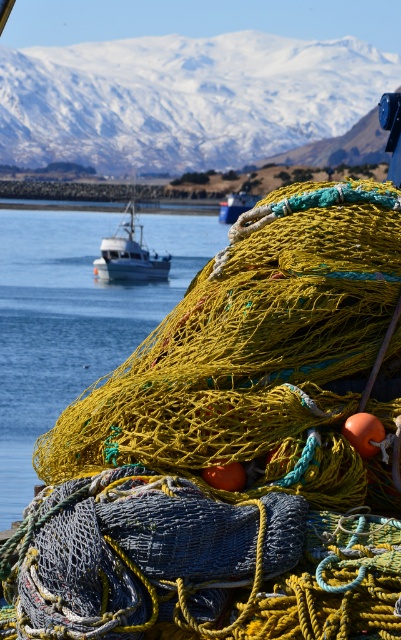
Can you confirm if white matte boat at center is positioned above white plastic boat at center?

Incorrect, white matte boat at center is not positioned above white plastic boat at center.

Can you confirm if white matte boat at center is thinner than white plastic boat at center?

No.

Between point (115, 260) and point (245, 204), which one is positioned behind?

The point (245, 204) is behind.

Find the location of a particular element. The width and height of the screenshot is (401, 640). white matte boat at center is located at coordinates (129, 253).

Consider the image. Can you confirm if blue textured net at center is thinner than white plastic boat at center?

Correct, blue textured net at center's width is less than white plastic boat at center's.

Is blue textured net at center in front of white plastic boat at center?

Yes, blue textured net at center is in front of white plastic boat at center.

Is point (172, 502) positioned behind point (228, 198)?

No, (172, 502) is closer to viewer.

Where is `blue textured net at center`? The width and height of the screenshot is (401, 640). blue textured net at center is located at coordinates (196, 564).

Who is positioned more to the right, transparent blue water at center or white matte boat at center?

From the viewer's perspective, white matte boat at center appears more on the right side.

Who is shorter, transparent blue water at center or white matte boat at center?

With less height is white matte boat at center.

Is point (48, 310) positioned behind point (157, 256)?

No.

Where is `transparent blue water at center`? transparent blue water at center is located at coordinates (74, 317).